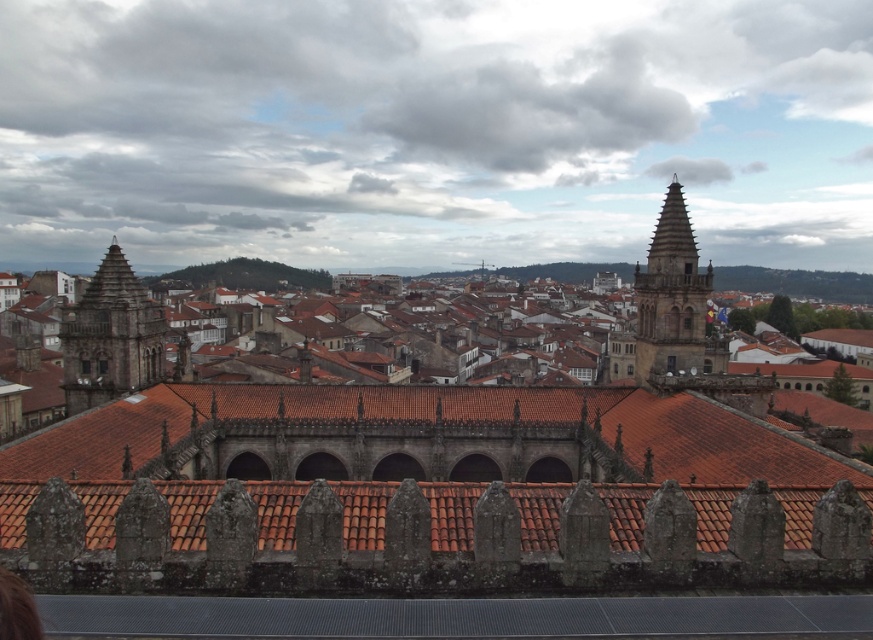
Who is lower down, red tile roof at center or brown stone tower at upper right?

red tile roof at center is below.

Locate an element on the screen. red tile roof at center is located at coordinates (423, 436).

Looking at this image, who is taller, red tile roof at center or dark brown stone tower at left?

Standing taller between the two is dark brown stone tower at left.

The image size is (873, 640). Describe the element at coordinates (423, 436) in the screenshot. I see `red tile roof at center` at that location.

Which is in front, point (76, 468) or point (149, 365)?

Point (76, 468) is in front.

Locate an element on the screen. Image resolution: width=873 pixels, height=640 pixels. red tile roof at center is located at coordinates (423, 436).

Is dark brown stone tower at left smaller than brown stone tower at upper right?

Indeed, dark brown stone tower at left has a smaller size compared to brown stone tower at upper right.

Is dark brown stone tower at left to the left of brown stone tower at upper right from the viewer's perspective?

Indeed, dark brown stone tower at left is positioned on the left side of brown stone tower at upper right.

Who is more distant from viewer, (88,289) or (696,292)?

Positioned behind is point (88,289).

Where is `dark brown stone tower at left`? dark brown stone tower at left is located at coordinates (111, 337).